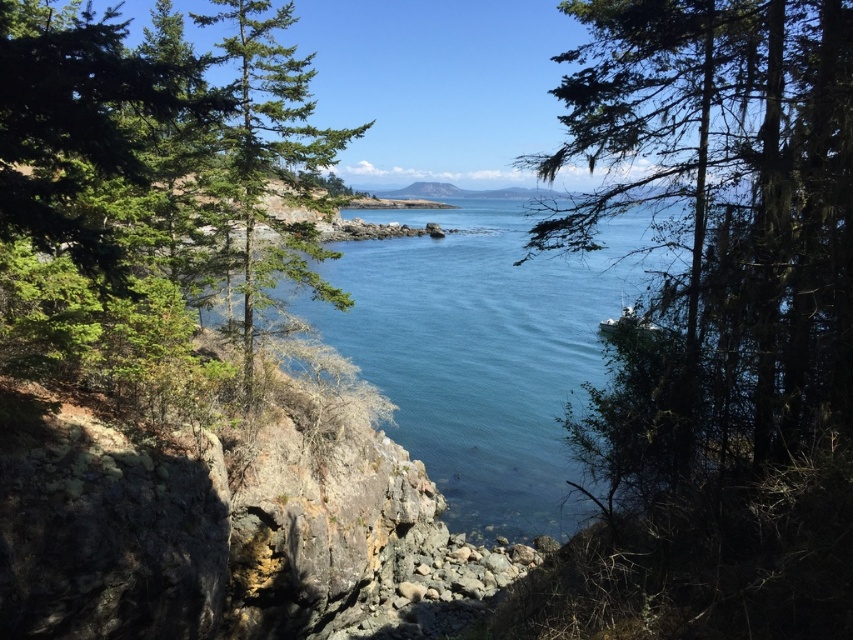
From the picture: Which is above, clear blue water at center or green needle-like tree at center?

green needle-like tree at center

Can you confirm if clear blue water at center is taller than green needle-like tree at center?

Incorrect, clear blue water at center's height is not larger of green needle-like tree at center's.

Who is more forward, [468,488] or [224,44]?

Positioned in front is point [224,44].

You are a GUI agent. You are given a task and a screenshot of the screen. Output one action in this format:
    pyautogui.click(x=<x>, y=<y>)
    Task: Click on the clear blue water at center
    
    Given the screenshot: What is the action you would take?
    pyautogui.click(x=480, y=353)